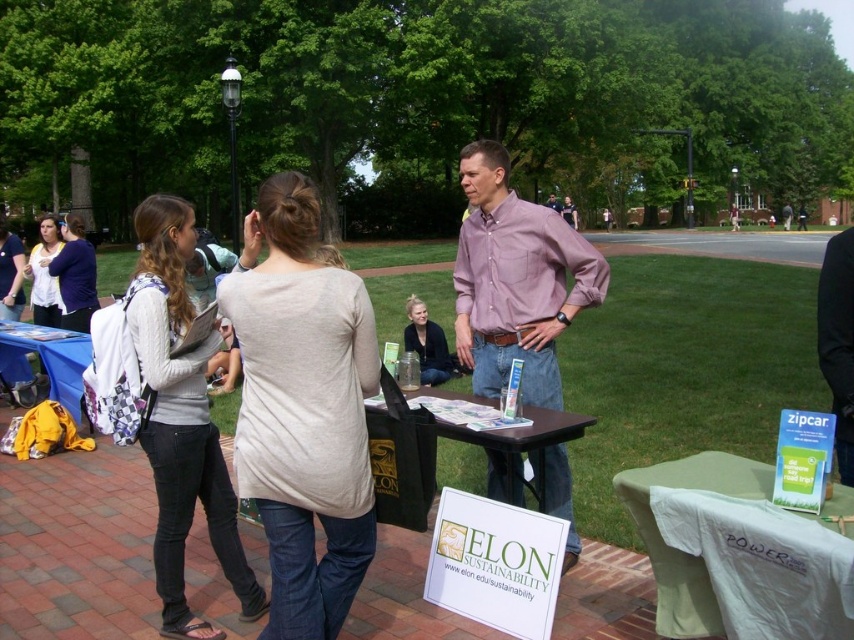
Question: Is white backpack at left below black plastic table at center?

Choices:
 (A) yes
 (B) no

Answer: (A)

Question: Is green fabric table at lower right to the right of black plastic table at center from the viewer's perspective?

Choices:
 (A) yes
 (B) no

Answer: (A)

Question: Which object is positioned farthest from the beige soft t-shirt at center?

Choices:
 (A) matte black shirt at center
 (B) green fabric table at lower right

Answer: (A)

Question: Which object is the closest to the blue fabric table at left?

Choices:
 (A) matte black shirt at center
 (B) white backpack at left

Answer: (A)

Question: Which of these objects is positioned closest to the matte pink shirt at center?

Choices:
 (A) matte black shirt at center
 (B) white backpack at left
 (C) matte white shirt at center

Answer: (B)

Question: Can you confirm if beige soft t-shirt at center is positioned to the left of black plastic table at center?

Choices:
 (A) yes
 (B) no

Answer: (A)